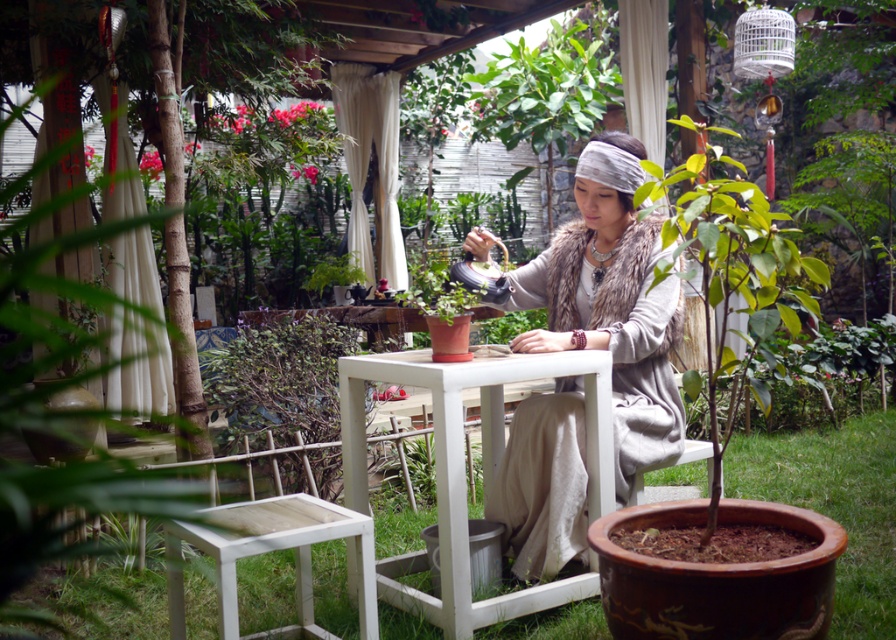
You are planning to place a decorative item on the fur vest at center and the white wooden table at center. Based on their sizes, which object can accommodate a larger decorative item?

The white wooden table at center can accommodate a larger decorative item because its width is greater than the fur vest at center.

You are a photographer taking a picture of the scene. You notice the fur vest at center and the green leafy plant at lower left. Which object is positioned higher in the image?

The fur vest at center is positioned higher than the green leafy plant at lower left according to the description.